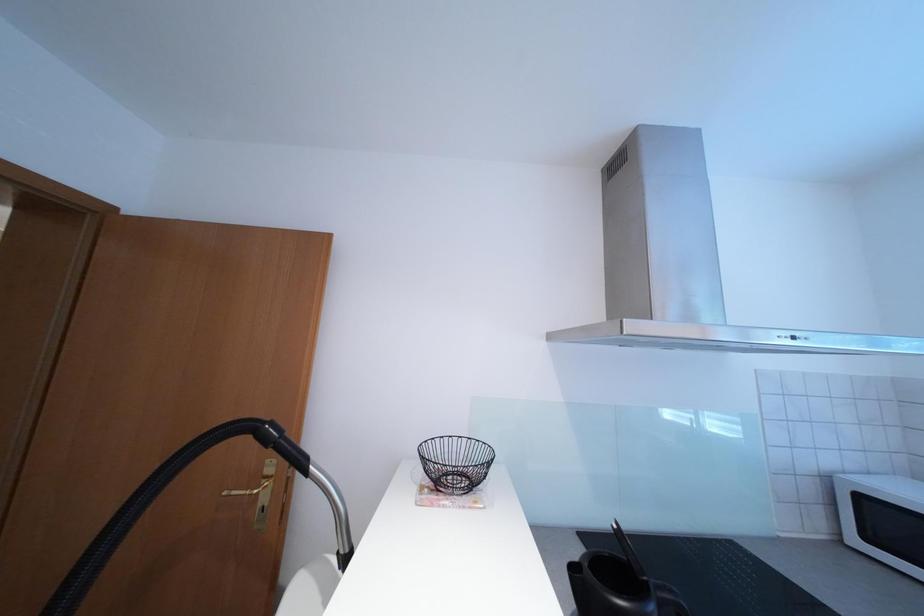
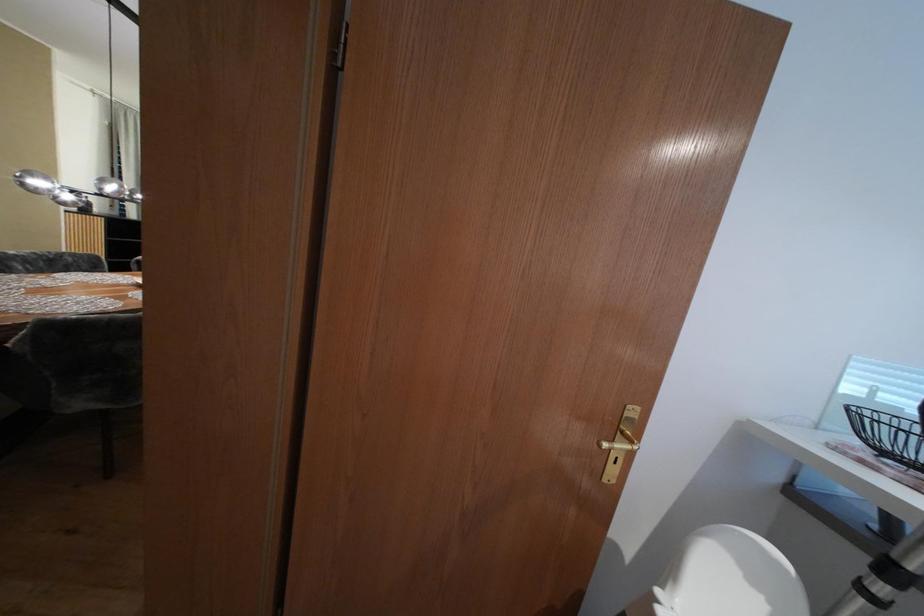
Question: What movement of the cameraman would produce the second image?

Choices:
 (A) Left
 (B) Right
 (C) Forward
 (D) Backward

Answer: (A)